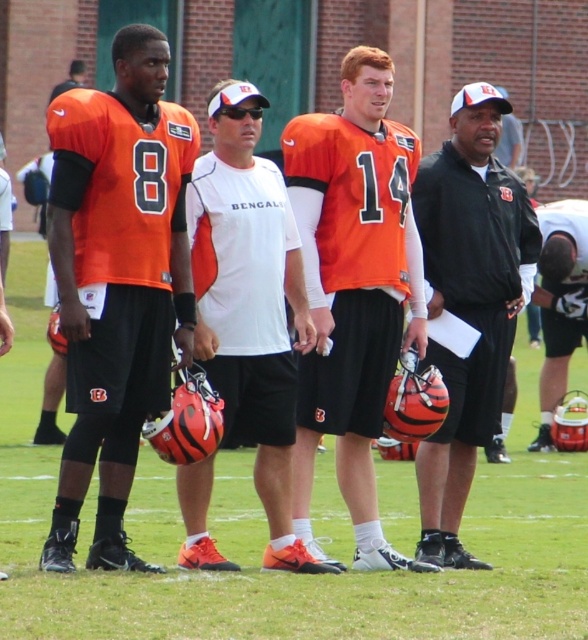
Does matte orange jersey at left lie in front of orange matte jersey at center?

Yes, it is in front of orange matte jersey at center.

Can you confirm if matte orange jersey at left is wider than orange matte jersey at center?

Yes, matte orange jersey at left is wider than orange matte jersey at center.

Who is more forward, (138, 38) or (292, 486)?

Point (138, 38) is more forward.

I want to click on matte orange jersey at left, so click(x=118, y=280).

Is black matte helmet at center behind white matte helmet at center?

No, it is not.

Looking at this image, does black matte helmet at center have a larger size compared to white matte helmet at center?

Incorrect, black matte helmet at center is not larger than white matte helmet at center.

What do you see at coordinates (469, 304) in the screenshot? The height and width of the screenshot is (640, 588). I see `black matte helmet at center` at bounding box center [469, 304].

Locate an element on the screen. The image size is (588, 640). black matte helmet at center is located at coordinates (469, 304).

Measure the distance between orange matte jersey at center and camera.

A distance of 14.17 meters exists between orange matte jersey at center and camera.

Does orange matte jersey at center come behind white matte helmet at center?

No, orange matte jersey at center is in front of white matte helmet at center.

In order to click on orange matte jersey at center in this screenshot , I will do `click(353, 289)`.